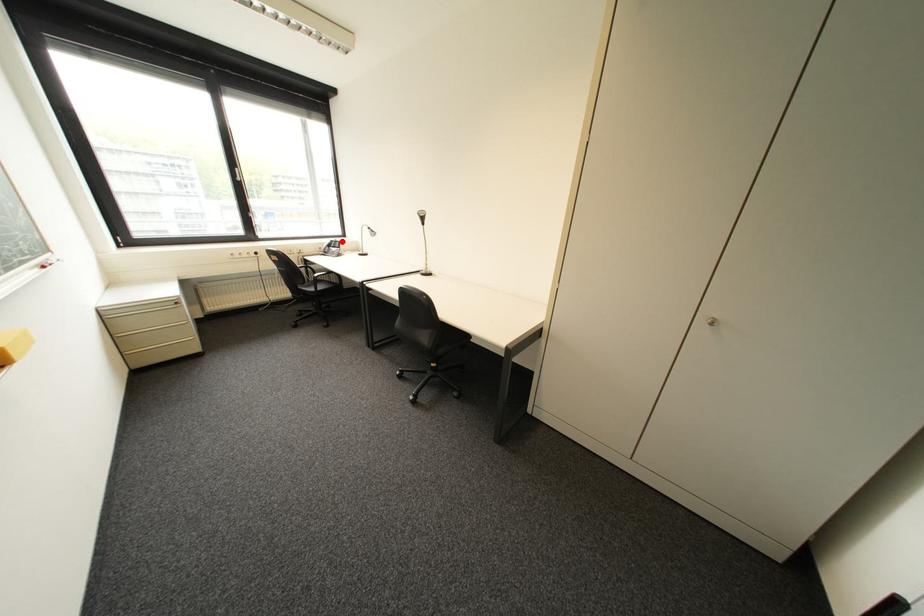
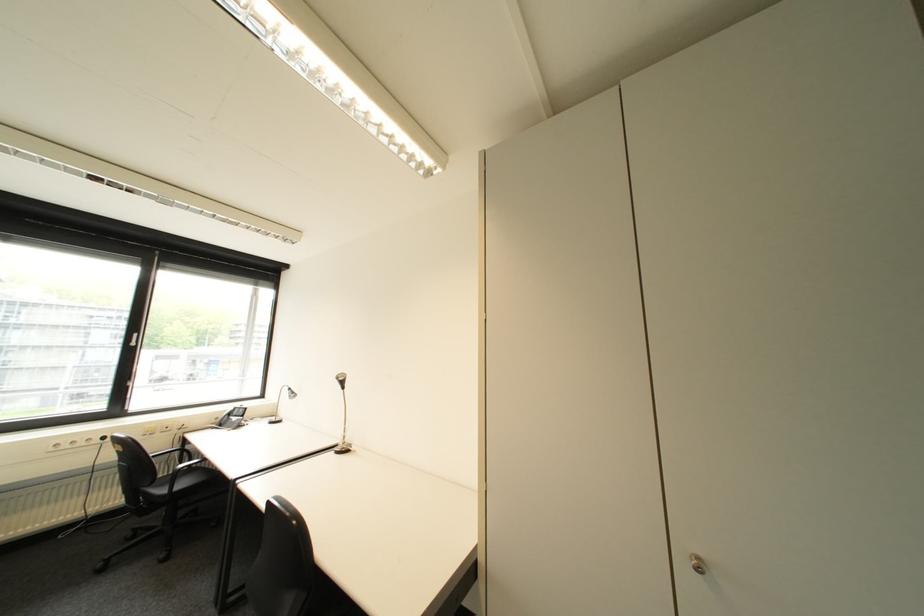
Find the pixel in the second image that matches the highlighted location in the first image.

(246, 408)